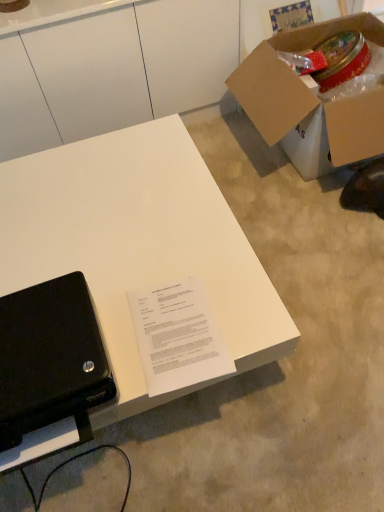
Locate an element on the screen. free space to the back side of black matte laptop at lower left is located at coordinates (87, 264).